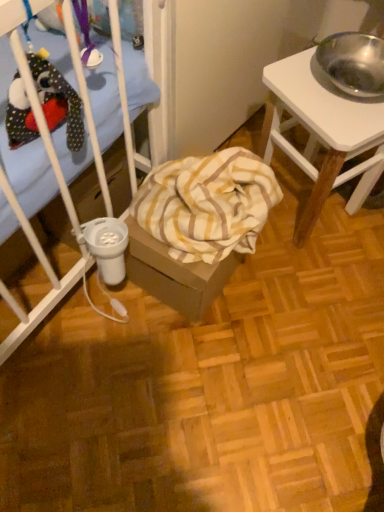
Where is `free space in front of yellow striped fabric at center`? This screenshot has height=512, width=384. free space in front of yellow striped fabric at center is located at coordinates tap(196, 360).